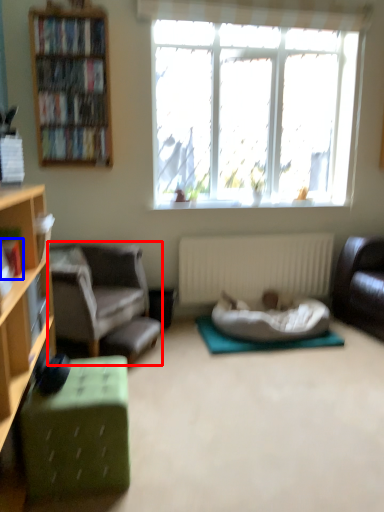
Question: Which object is closer to the camera taking this photo, chair (highlighted by a red box) or book (highlighted by a blue box)?

Choices:
 (A) chair
 (B) book

Answer: (B)